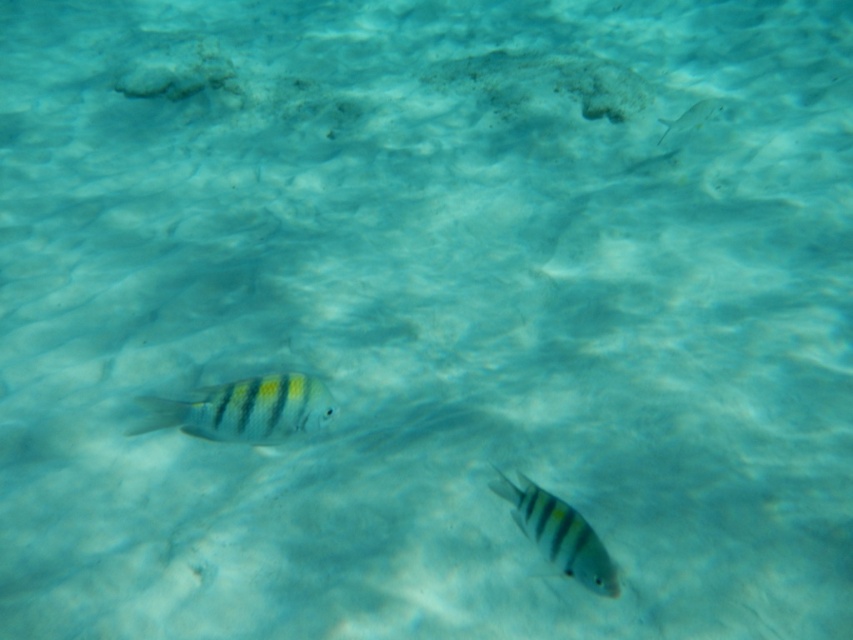
You are a diver observing two points underwater. The first point is at coordinates point (x=326, y=417) and the second is at point (x=546, y=541). From your vantage point, which point is closer to you?

Point (x=546, y=541) is closer to you because point (x=326, y=417) is behind it.

You are a marine biologist observing the underwater scene. You notice the yellow striped fish at center and the translucent white fish at upper right. Which fish appears larger in the image?

The yellow striped fish at center appears larger because it is closer to the viewer than the translucent white fish at upper right.